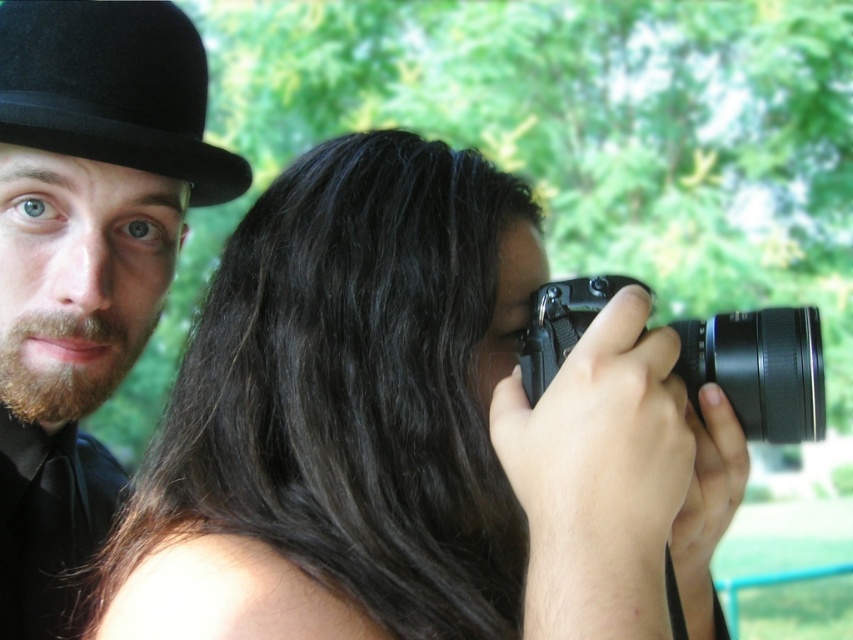
Can you confirm if black matte bowler hat at upper left is positioned below black plastic camera at center?

Actually, black matte bowler hat at upper left is above black plastic camera at center.

Between black matte bowler hat at upper left and black plastic camera at center, which one is positioned lower?

black plastic camera at center is lower down.

What are the coordinates of `black matte bowler hat at upper left` in the screenshot? It's located at (84, 259).

Which of these two, black felt bowler hat at upper left or black plastic camera at center, stands shorter?

black plastic camera at center

Can you confirm if black felt bowler hat at upper left is positioned below black plastic camera at center?

No.

Is point (25, 17) in front of point (543, 298)?

No, (25, 17) is further to viewer.

Locate an element on the screen. Image resolution: width=853 pixels, height=640 pixels. black felt bowler hat at upper left is located at coordinates (113, 90).

Does smooth black camera at center appear on the left side of black plastic camera at center?

Indeed, smooth black camera at center is positioned on the left side of black plastic camera at center.

Is smooth black camera at center shorter than black plastic camera at center?

Incorrect, smooth black camera at center's height does not fall short of black plastic camera at center's.

Where is `smooth black camera at center`? This screenshot has width=853, height=640. smooth black camera at center is located at coordinates (415, 433).